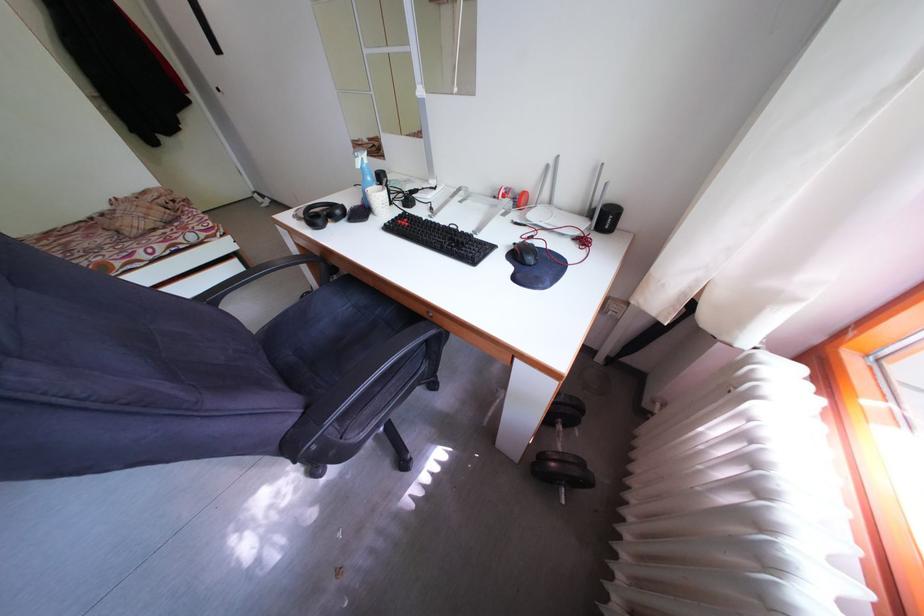
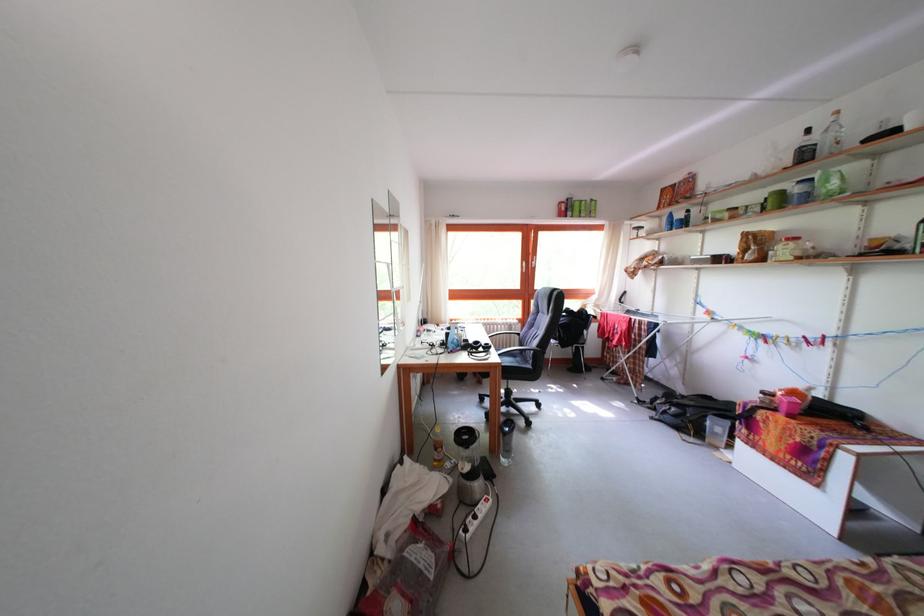
Question: I am providing you with two images of the same scene from different viewpoints. Please identify which objects are invisible in image2.

Choices:
 (A) blue spray bottle
 (B) jar with red lid
 (C) metal box latch
 (D) black headphones

Answer: (D)